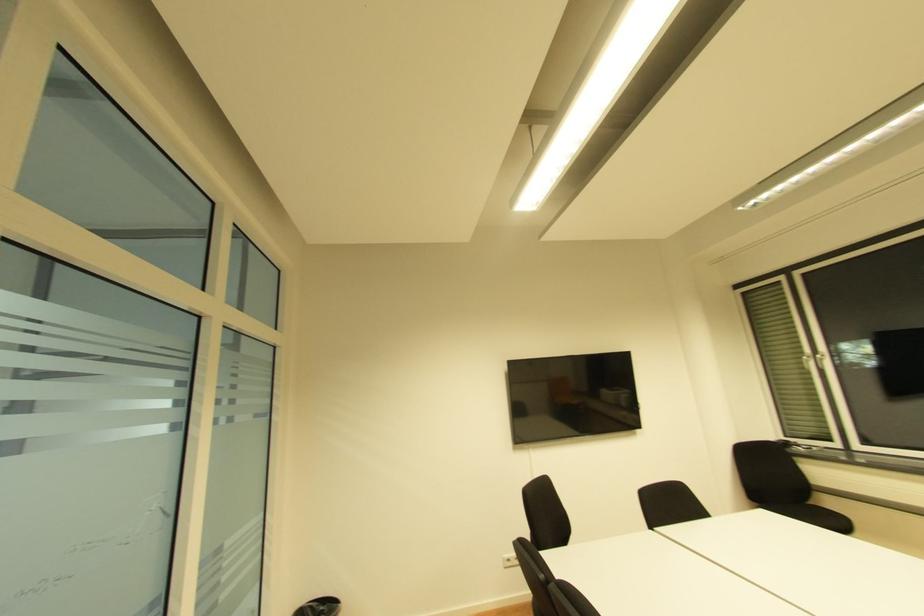
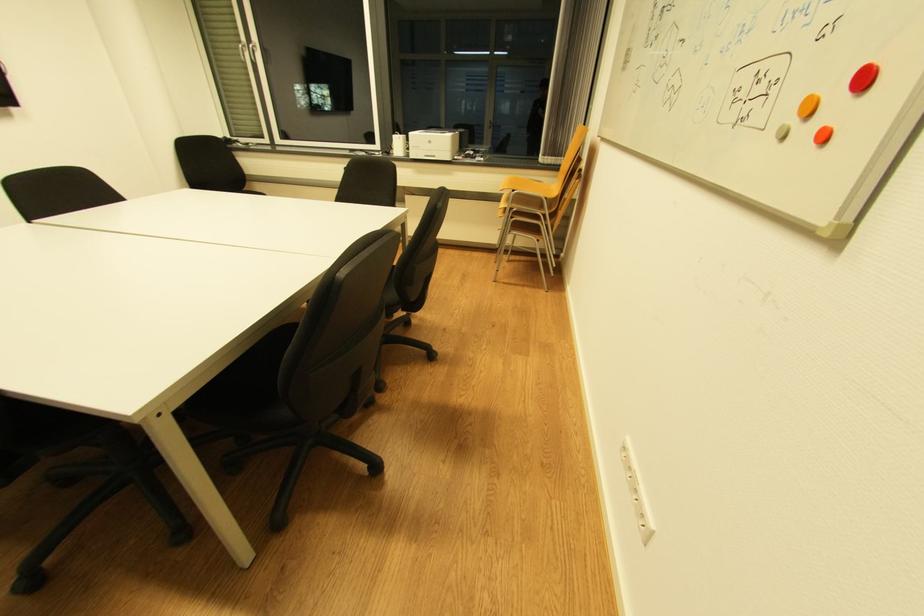
Based on the continuous images, in which direction is the camera rotating?

The camera's rotation is toward right-down.